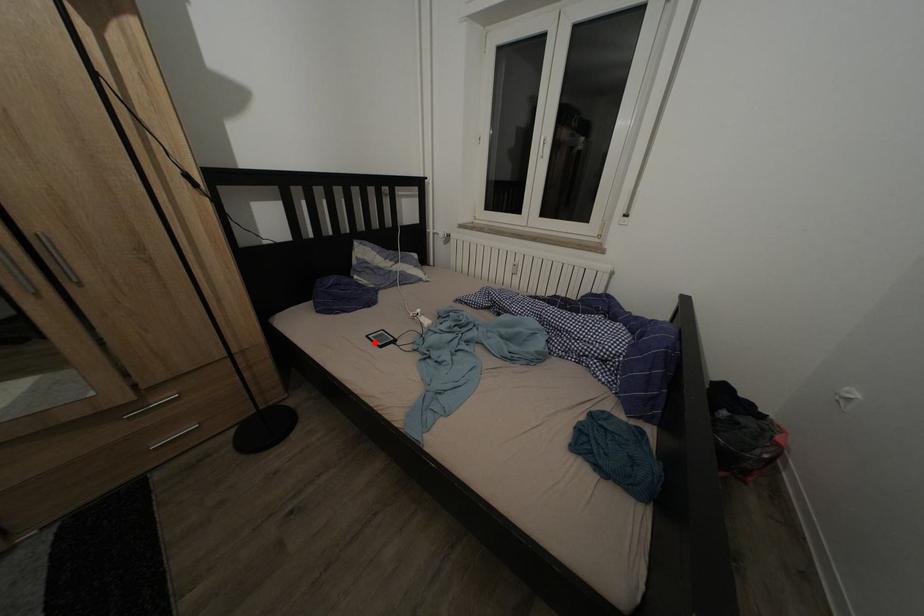
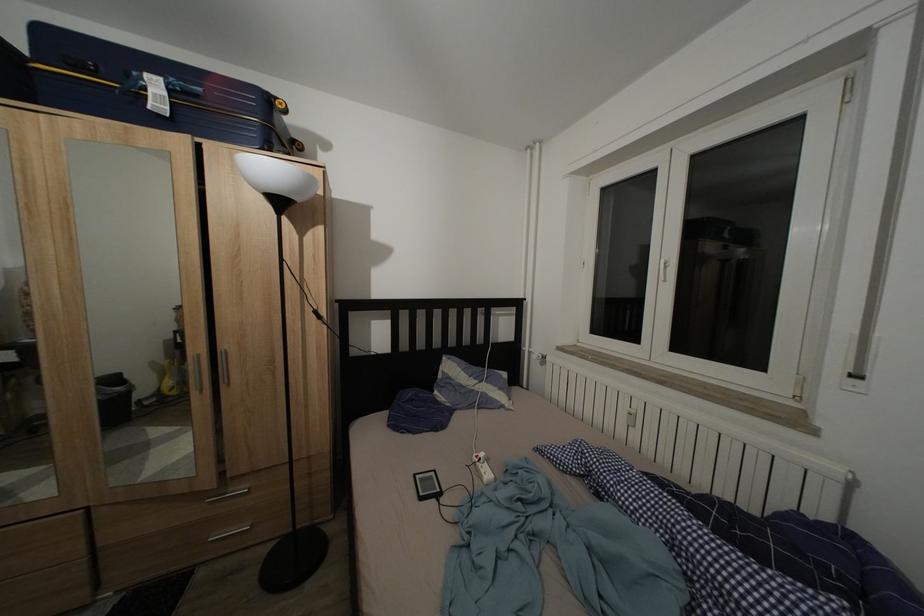
Locate, in the second image, the point that corresponds to the highlighted location in the first image.

(422, 482)